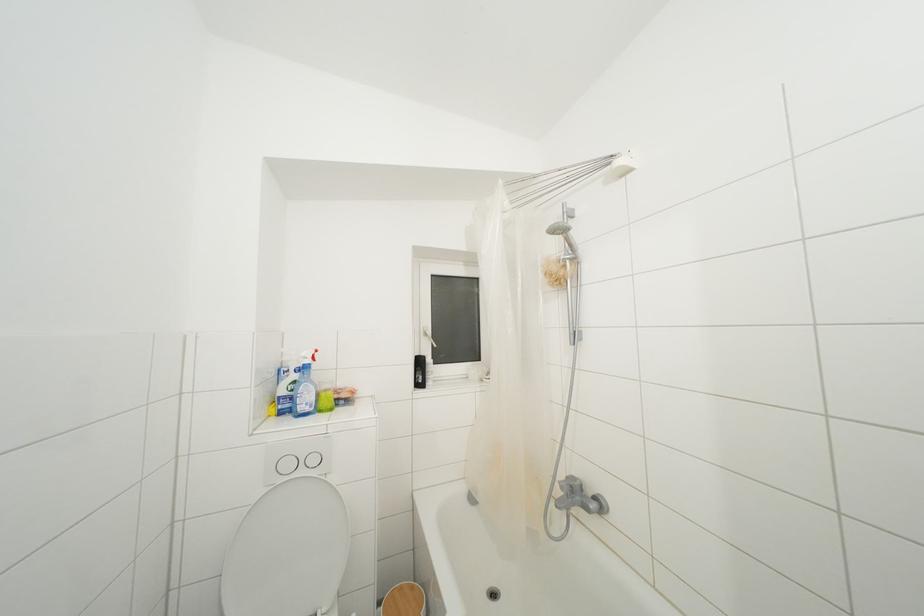
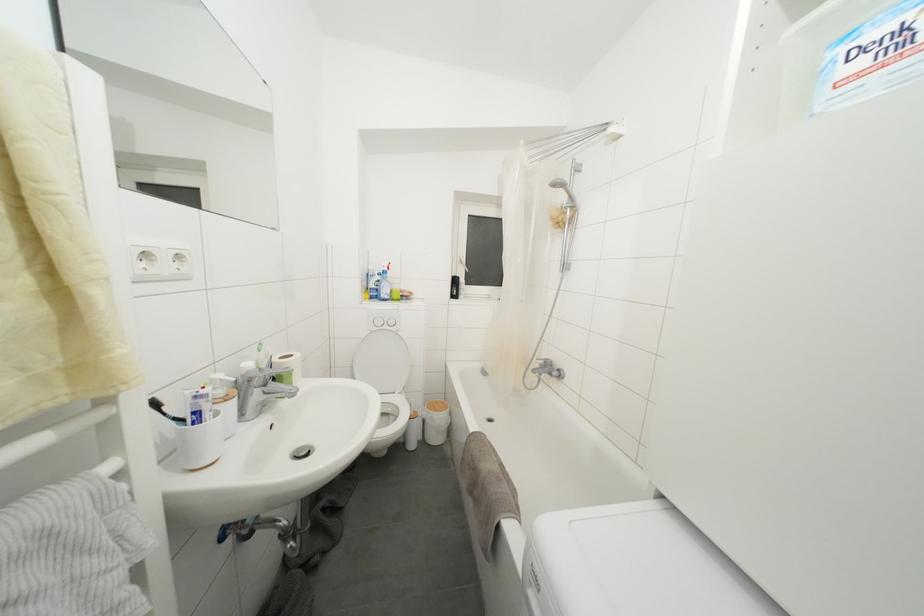
Find the pixel in the second image that matches pixel 290 411 in the first image.

(379, 300)